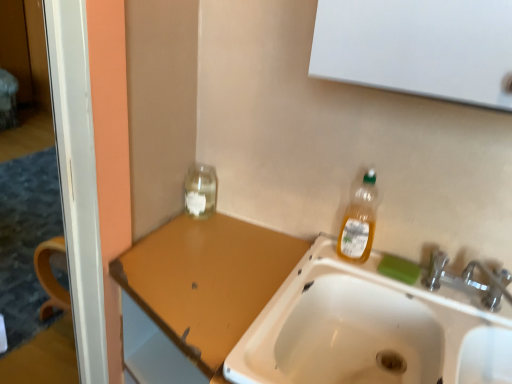
Locate an element on the screen. The width and height of the screenshot is (512, 384). free space that is to the left of green matte bar of soap at sink right is located at coordinates (349, 269).